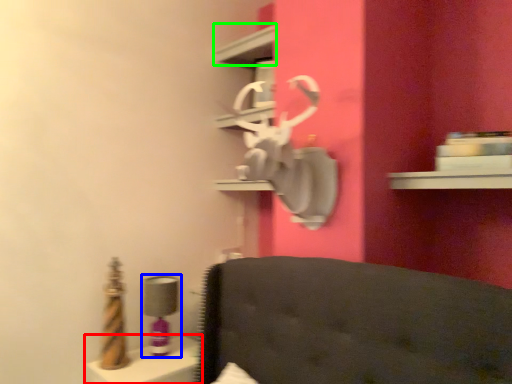
Question: Considering the real-world distances, which object is closest to vanity (highlighted by a red box)? table lamp (highlighted by a blue box) or shelf (highlighted by a green box).

Choices:
 (A) table lamp
 (B) shelf

Answer: (A)